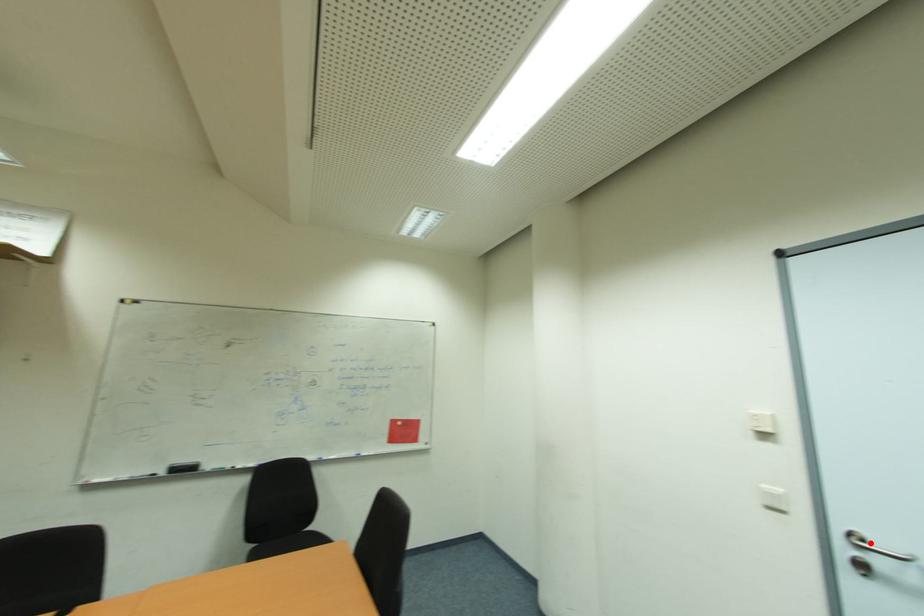
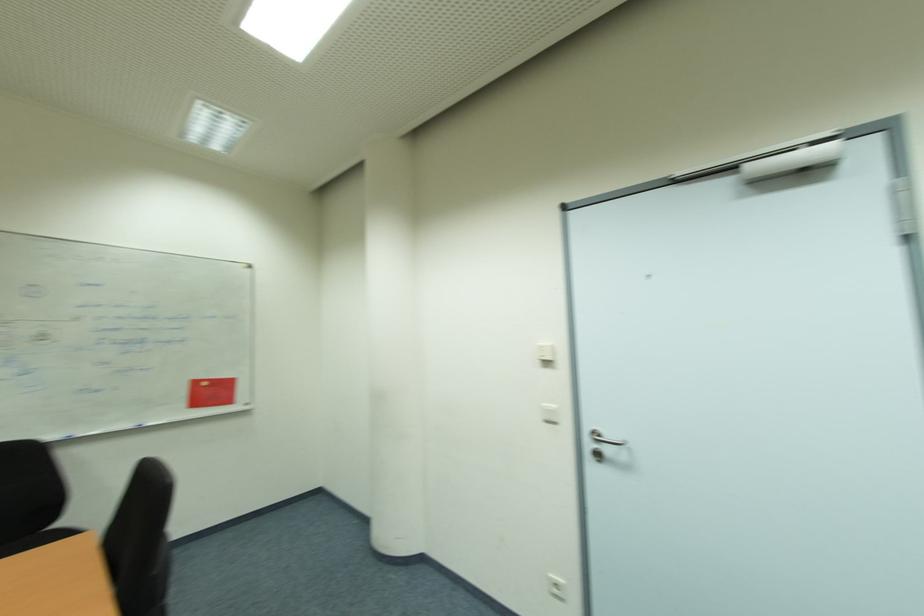
In the second image, find the point that corresponds to the highlighted location in the first image.

(602, 436)